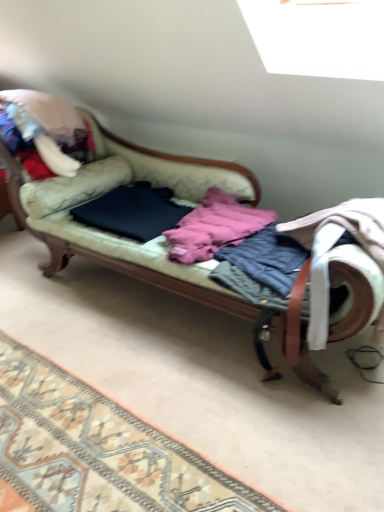
You are a GUI agent. You are given a task and a screenshot of the screen. Output one action in this format:
    pyautogui.click(x=<x>, y=<y>)
    Task: Click on the free space in front of velvet green couch at center
    
    Given the screenshot: What is the action you would take?
    pyautogui.click(x=161, y=405)